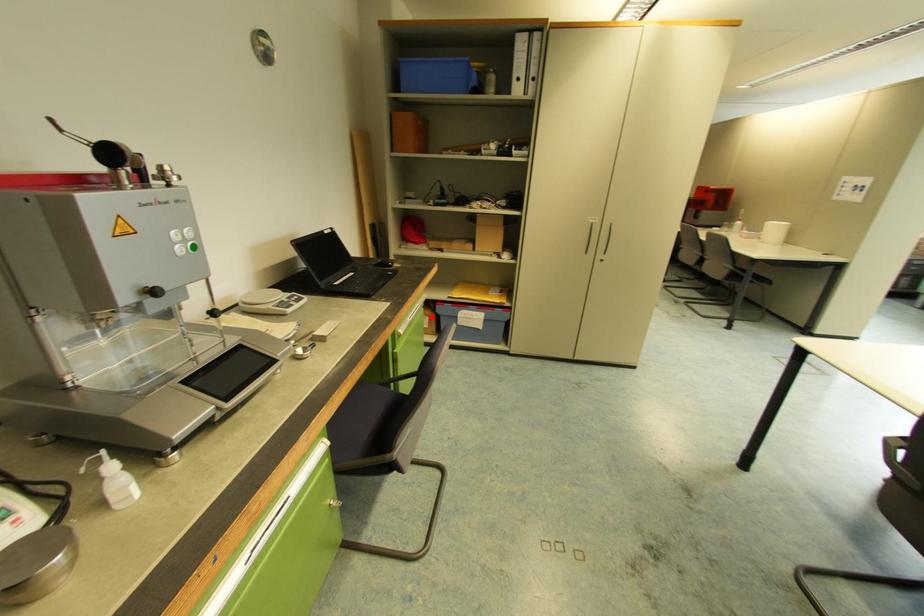
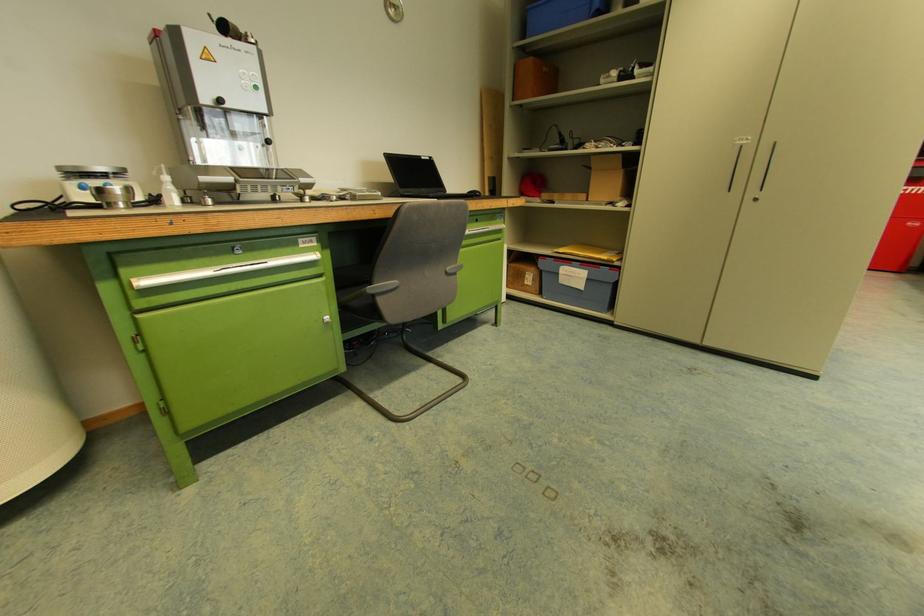
Question: A red point is marked in image1. In image2, is the corresponding 3D point closer to the camera or farther? Reply with the corresponding letter.

Choices:
 (A) The corresponding 3D point is closer.
 (B) The corresponding 3D point is farther.

Answer: (A)